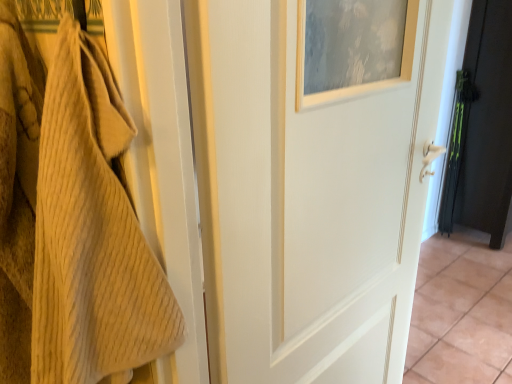
Question: Is white glossy tile at center to the left of black matte door at right, which appears as the second door when viewed from the front, from the viewer's perspective?

Choices:
 (A) no
 (B) yes

Answer: (B)

Question: From a real-world perspective, does white glossy tile at center sit lower than black matte door at right, which is counted as the 2th door, starting from the left?

Choices:
 (A) yes
 (B) no

Answer: (A)

Question: From the image's perspective, is white glossy tile at center on black matte door at right, which is counted as the 2th door, starting from the left?

Choices:
 (A) yes
 (B) no

Answer: (B)

Question: Considering the relative positions of white glossy tile at center and black matte door at right, which appears as the second door when viewed from the front, in the image provided, is white glossy tile at center behind black matte door at right, which appears as the second door when viewed from the front,?

Choices:
 (A) no
 (B) yes

Answer: (A)

Question: From a real-world perspective, is white glossy tile at center physically above black matte door at right, which appears as the second door when viewed from the front?

Choices:
 (A) no
 (B) yes

Answer: (A)

Question: From the image's perspective, is white painted wood door at center, the 1th door from the front, located above or below white glossy tile at center?

Choices:
 (A) below
 (B) above

Answer: (B)

Question: Looking at their shapes, would you say white painted wood door at center, the 1th door from the front, is wider or thinner than white glossy tile at center?

Choices:
 (A) thin
 (B) wide

Answer: (A)

Question: From a real-world perspective, is white painted wood door at center, the second door positioned from the back, physically located above or below white glossy tile at center?

Choices:
 (A) above
 (B) below

Answer: (A)

Question: Would you say white painted wood door at center, which ranks as the 1th door in left-to-right order, is to the left or to the right of white glossy tile at center in the picture?

Choices:
 (A) right
 (B) left

Answer: (B)

Question: From the image's perspective, is white glossy tile at center located above or below white painted wood door at center, the 1th door from the front?

Choices:
 (A) below
 (B) above

Answer: (A)

Question: Is white glossy tile at center in front of or behind white painted wood door at center, which ranks as the 1th door in left-to-right order, in the image?

Choices:
 (A) behind
 (B) front

Answer: (A)

Question: From a real-world perspective, is white glossy tile at center above or below white painted wood door at center, the second door positioned from the back?

Choices:
 (A) below
 (B) above

Answer: (A)

Question: Looking at their shapes, would you say white glossy tile at center is wider or thinner than white painted wood door at center, the 1th door from the front?

Choices:
 (A) thin
 (B) wide

Answer: (B)

Question: From a real-world perspective, relative to white painted wood door at center, which ranks as the 1th door in left-to-right order, is black matte door at right, arranged as the first door when viewed from the right, vertically above or below?

Choices:
 (A) above
 (B) below

Answer: (B)

Question: Considering their positions, is black matte door at right, arranged as the first door when viewed from the right, located in front of or behind white painted wood door at center, which ranks as the 1th door in left-to-right order?

Choices:
 (A) front
 (B) behind

Answer: (B)